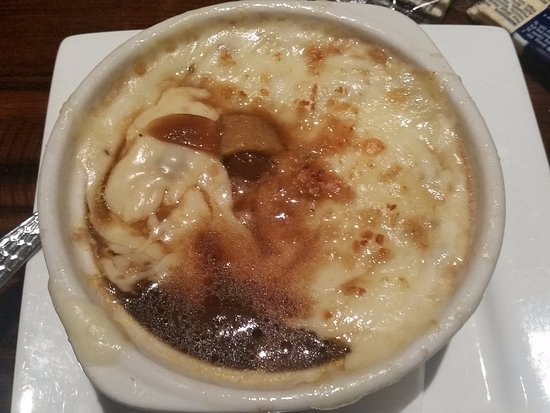
The width and height of the screenshot is (550, 413). I want to click on white square plate, so click(522, 229).